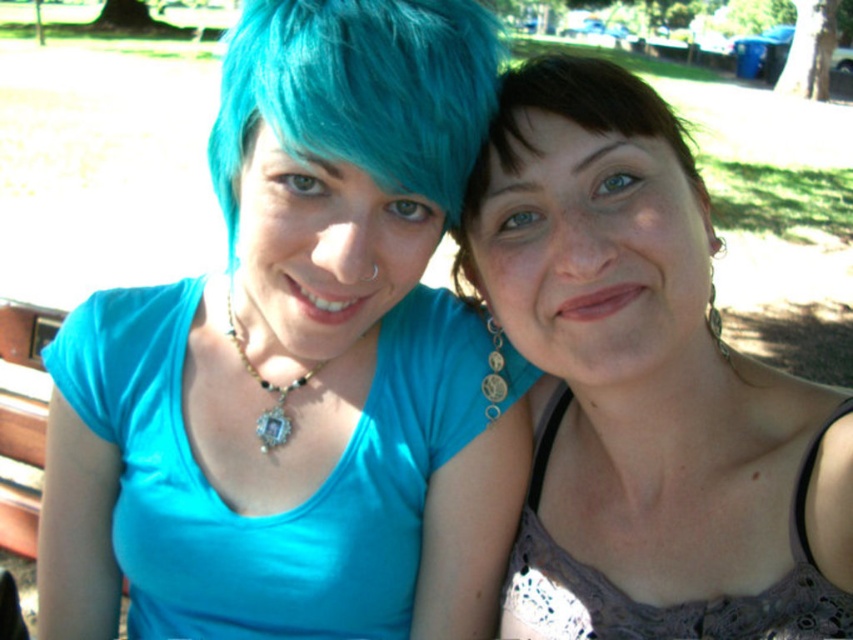
You are a photographer trying to adjust your camera to focus on the matte blue shirt at left. What are the coordinates you should set for the focus point?

The coordinates for the matte blue shirt at left are at point (297, 364), so you should set the focus point to those coordinates.